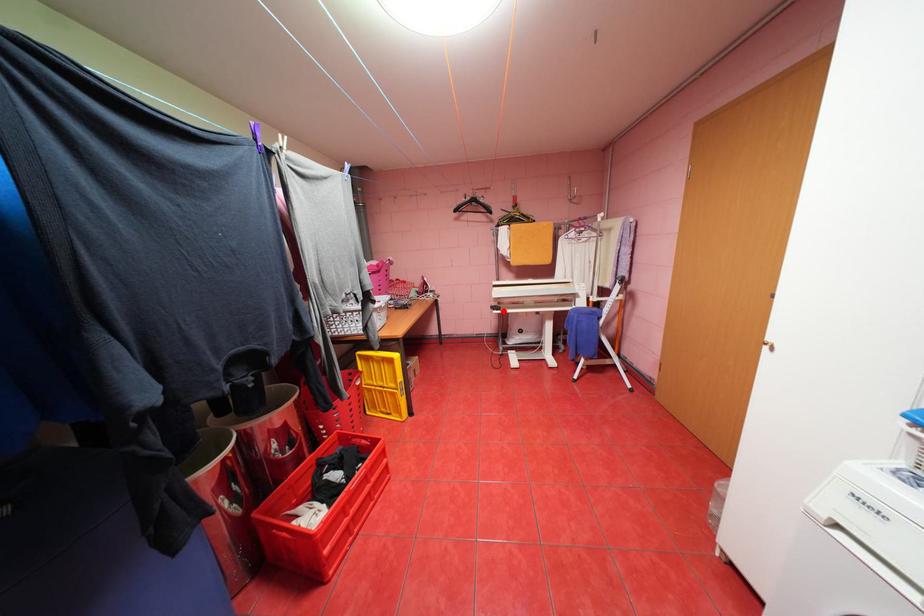
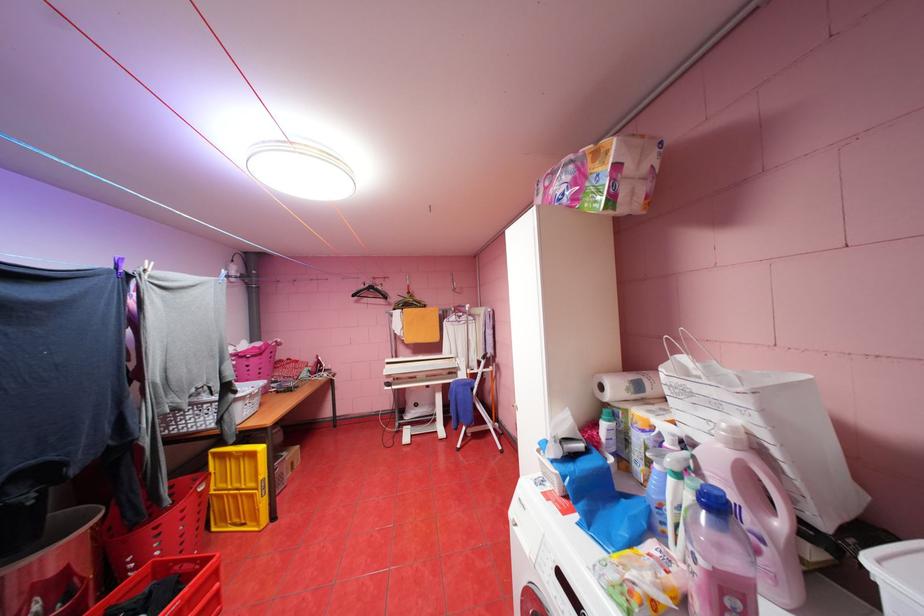
Question: I am providing you with two images of the same scene from different viewpoints. In image1, a red point is highlighted. Considering the same 3D point in image2, which of the following is correct?

Choices:
 (A) It is closer
 (B) It is farther

Answer: (B)